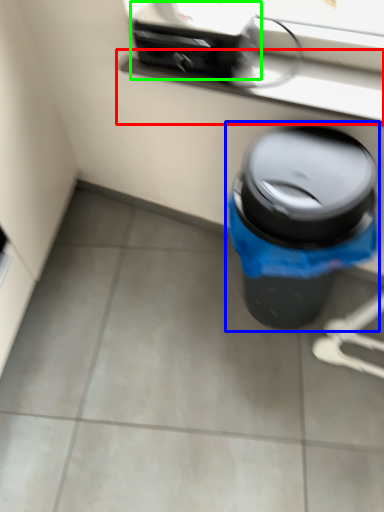
Question: Based on their relative distances, which object is farther from window sill (highlighted by a red box)? Choose from waste container (highlighted by a blue box) and appliance (highlighted by a green box).

Choices:
 (A) waste container
 (B) appliance

Answer: (A)